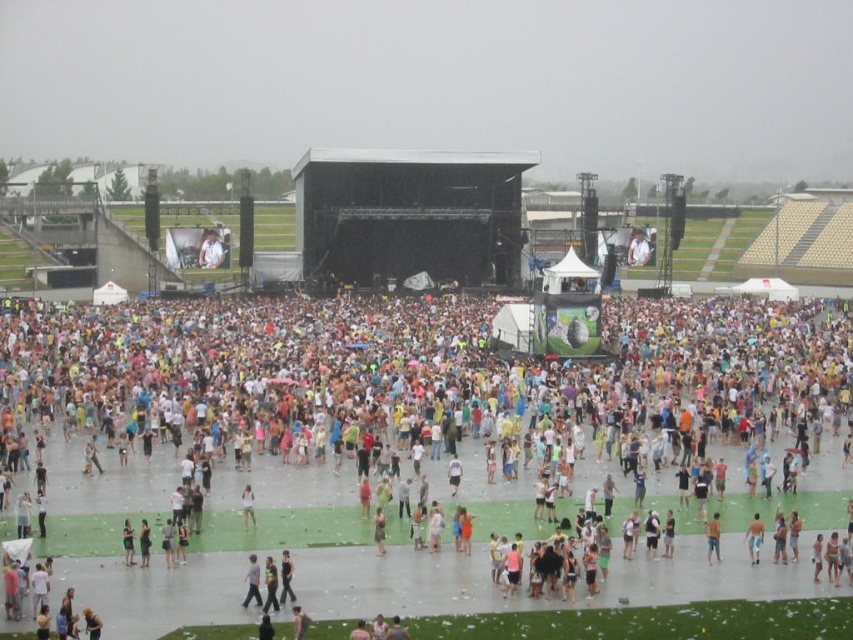
Can you confirm if white cotton t-shirt at center is positioned below light brown leather jacket at center?

No.

Can you confirm if white cotton t-shirt at center is positioned to the left of light brown leather jacket at center?

In fact, white cotton t-shirt at center is to the right of light brown leather jacket at center.

Does point (434, 342) come in front of point (248, 588)?

No.

This screenshot has width=853, height=640. I want to click on white cotton t-shirt at center, so click(x=413, y=452).

Can you confirm if light brown leather jacket at center is thinner than white matte dress at center?

No, light brown leather jacket at center is not thinner than white matte dress at center.

Locate an element on the screen. light brown leather jacket at center is located at coordinates (252, 582).

At what (x,y) coordinates should I click in order to perform the action: click on light brown leather jacket at center. Please return your answer as a coordinate pair (x, y). This screenshot has width=853, height=640. Looking at the image, I should click on [252, 582].

Image resolution: width=853 pixels, height=640 pixels. I want to click on light brown leather jacket at center, so (252, 582).

Which is more to the left, white cotton t-shirt at center or white matte dress at center?

From the viewer's perspective, white matte dress at center appears more on the left side.

Looking at this image, does white cotton t-shirt at center appear over white matte dress at center?

Yes.

Measure the distance between point (334, 355) and camera.

114.68 meters

Identify the location of white cotton t-shirt at center. (413, 452).